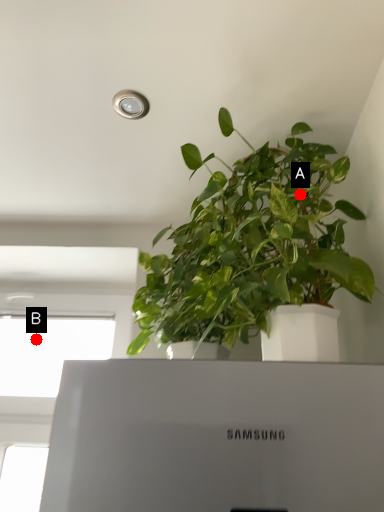
Question: Two points are circled on the image, labeled by A and B beside each circle. Among these points, which one is farthest from the camera?

Choices:
 (A) A is further
 (B) B is further

Answer: (B)